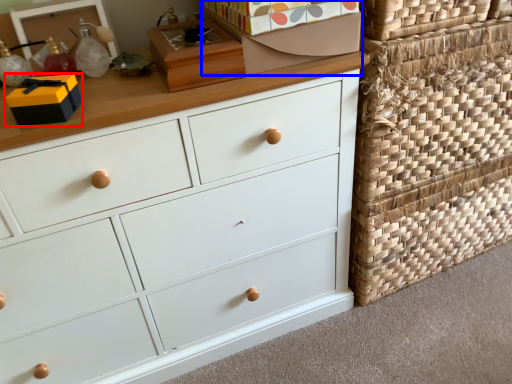
Question: Which point is further to the camera, storage box (highlighted by a red box) or shoe box (highlighted by a blue box)?

Choices:
 (A) storage box
 (B) shoe box

Answer: (B)